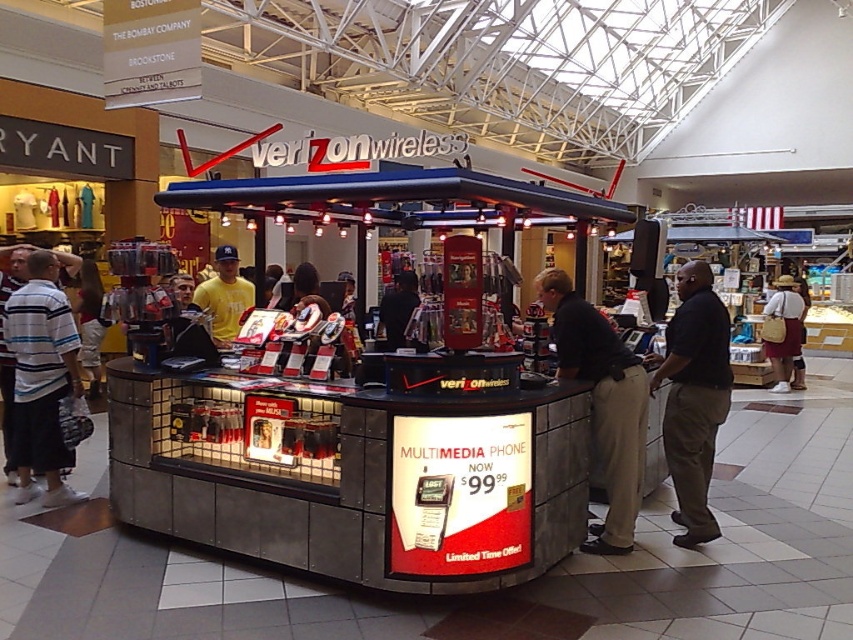
You are a customer standing in front of the Verizon Wireless kiosk. You notice a point marked at coordinates [694,397]. Based on the scene description, where is this point located?

The point [694,397] is located on the black smooth shirt at right.

You are trying to decide which shirt to buy between the striped cotton shirt at left and the black fabric shirt at center. Which one is bigger?

The striped cotton shirt at left has a larger size compared to the black fabric shirt at center.

You are trying to decide between two items displayed at the Verizon Wireless kiosk. You see the dark brown pants at center and the khaki cotton shorts at center. Which item is smaller in size?

The dark brown pants at center is smaller than the khaki cotton shorts at center.